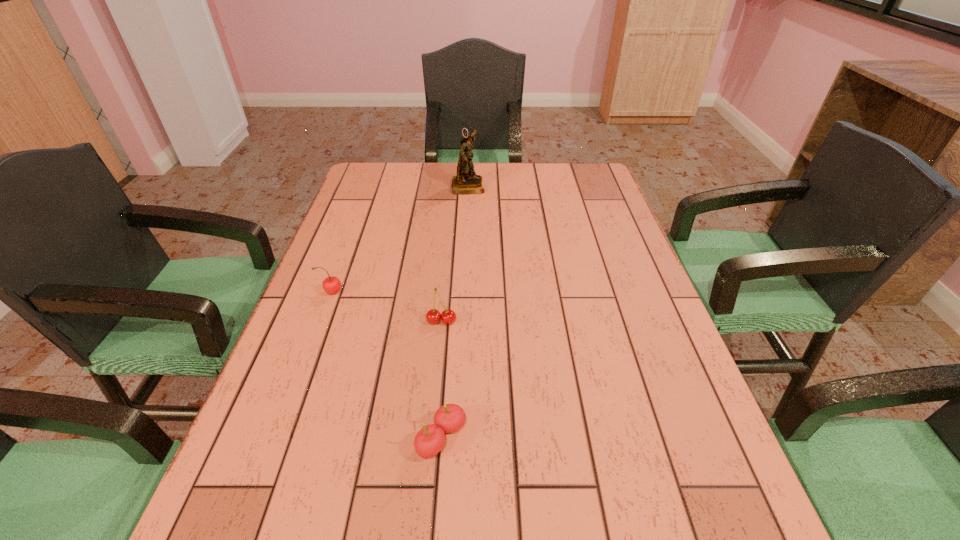
Where is `the farthest object`? This screenshot has height=540, width=960. the farthest object is located at coordinates (466, 182).

Find the location of a particular element. This screenshot has height=540, width=960. figurine is located at coordinates (466, 182).

Find the location of a particular element. the second nearest object is located at coordinates (433, 316).

Locate an element on the screen. This screenshot has width=960, height=540. the leftmost cherry is located at coordinates (331, 285).

Identify the location of the farthest cherry. The width and height of the screenshot is (960, 540). (331, 285).

In order to click on the nearest object in this screenshot , I will do `click(449, 418)`.

Image resolution: width=960 pixels, height=540 pixels. What are the coordinates of `vacant area situated 0.200m on the front-facing side of the figurine` in the screenshot? It's located at (544, 185).

The image size is (960, 540). I want to click on free space located with the stems of the third farthest object pointing upwards, so click(426, 490).

The width and height of the screenshot is (960, 540). Find the location of `blank area located 0.340m on the back of the leftmost cherry`. blank area located 0.340m on the back of the leftmost cherry is located at coordinates (362, 212).

The height and width of the screenshot is (540, 960). I want to click on free space located on the front of the nearest object, so click(435, 535).